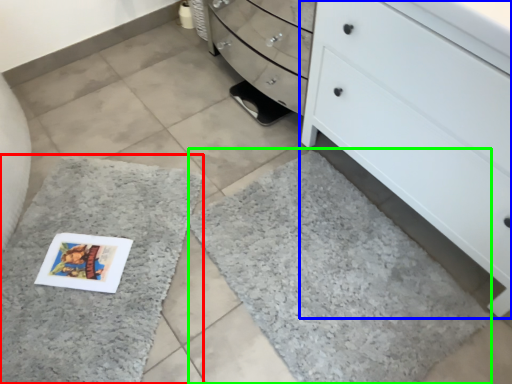
Question: Which object is positioned closest to bath mat (highlighted by a red box)? Select from chest of drawers (highlighted by a blue box) and bath mat (highlighted by a green box).

Choices:
 (A) chest of drawers
 (B) bath mat

Answer: (B)